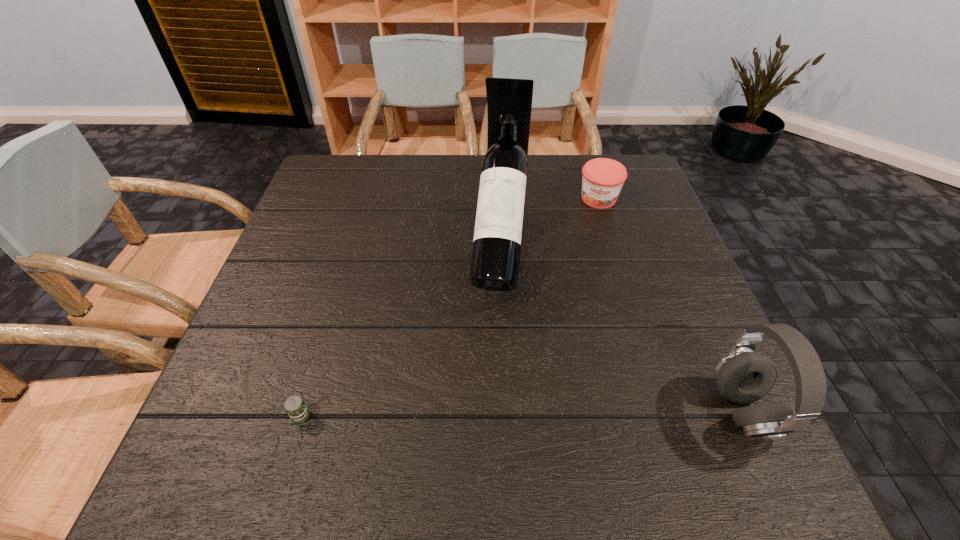
Where is `unoccupied position between the third object from left to right and the shortest object`? unoccupied position between the third object from left to right and the shortest object is located at coordinates (449, 307).

This screenshot has height=540, width=960. What are the coordinates of `unoccupied position between the headset and the shortest object` in the screenshot? It's located at (522, 414).

Identify the location of free space between the shortest object and the tallest object. (400, 333).

Find the location of a particular element. The image size is (960, 540). vacant space that's between the wine bottle and the leftmost object is located at coordinates (400, 333).

Find the location of a particular element. The image size is (960, 540). empty location between the beer can and the rightmost object is located at coordinates (522, 414).

Where is `vacant region between the third tallest object and the leftmost object`? This screenshot has height=540, width=960. vacant region between the third tallest object and the leftmost object is located at coordinates (449, 307).

I want to click on unoccupied area between the beer can and the second shortest object, so click(449, 307).

Where is `free point between the leftmost object and the jam`? This screenshot has width=960, height=540. free point between the leftmost object and the jam is located at coordinates (449, 307).

At what (x,y) coordinates should I click in order to perform the action: click on free space between the wine bottle and the beer can. Please return your answer as a coordinate pair (x, y). The height and width of the screenshot is (540, 960). Looking at the image, I should click on (400, 333).

Identify the location of free space between the rightmost object and the second object from left to right. The image size is (960, 540). 621,331.